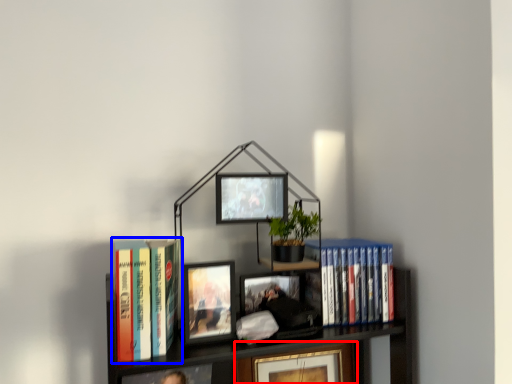
Question: Which of the following is the farthest to the observer, picture frame (highlighted by a red box) or book (highlighted by a blue box)?

Choices:
 (A) picture frame
 (B) book

Answer: (A)